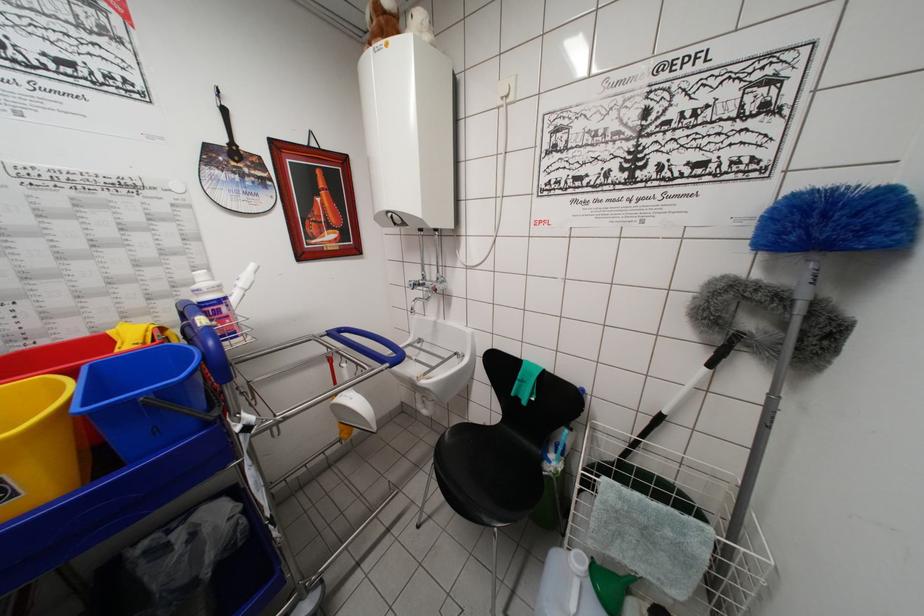
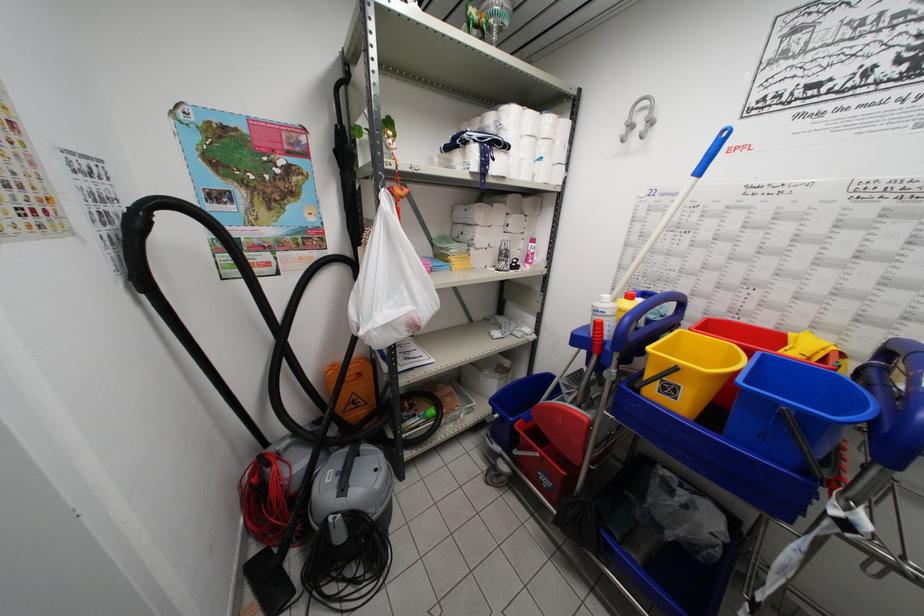
How did the camera likely rotate?

The camera rotated toward left-down.